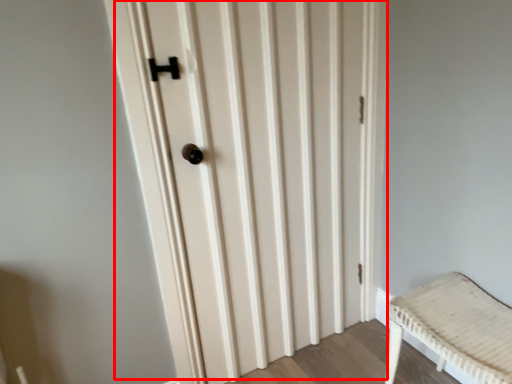
Question: From the image, what is the correct spatial relationship of door (annotated by the red box) in relation to furniture?

Choices:
 (A) right
 (B) left

Answer: (B)